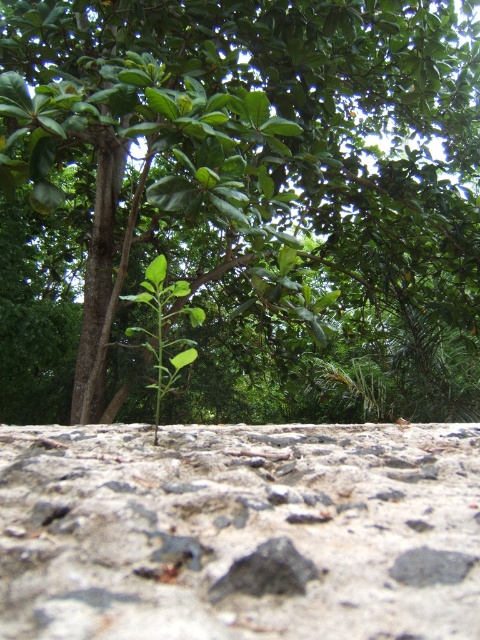
You are standing in a garden and want to touch both the green leafy tree at center and the gray rough concrete at center. Which object should you reach for first?

The green leafy tree at center is closer to you than the gray rough concrete at center, so you should reach for the green leafy tree at center first.

You are standing in front of the plant growing from the rough surface. You notice two points marked in the image. Which point is closer to you, point (4, 125) or point (63, 451)?

Point (63, 451) is closer to you because point (4, 125) is behind it.

You are a gardener assessing the growth of plants in a natural setting. You notice a green leafy tree at center and a gray rough concrete at center. Which object occupies more horizontal space in the image?

The green leafy tree at center has a greater width than the gray rough concrete at center, so it occupies more horizontal space in the image.